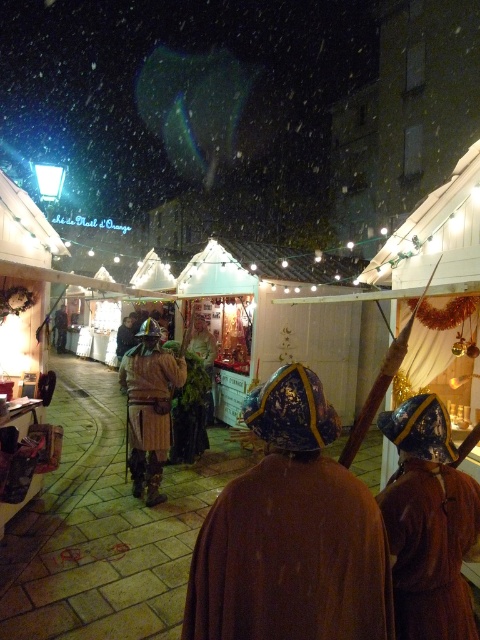
Is point (324, 611) positioned before point (152, 339)?

Yes, point (324, 611) is in front of point (152, 339).

Can you confirm if brown woolen robe at center is bigger than brown leather armor at center?

Incorrect, brown woolen robe at center is not larger than brown leather armor at center.

In the scene shown: Who is more forward, (257, 577) or (165, 403)?

Point (257, 577) is in front.

The height and width of the screenshot is (640, 480). I want to click on brown woolen robe at center, so click(x=290, y=557).

Between point (286, 620) and point (448, 612), which one is positioned in front?

Positioned in front is point (286, 620).

Locate an element on the screen. brown woolen robe at center is located at coordinates pos(290,557).

Is point (230, 483) farther from viewer compared to point (417, 598)?

No, it is not.

Where is `brown woolen robe at center`? brown woolen robe at center is located at coordinates (290, 557).

Which is behind, point (423, 563) or point (145, 432)?

Point (145, 432)

Who is positioned more to the right, brown velvet robe at center or brown leather armor at center?

brown velvet robe at center is more to the right.

Who is more distant from viewer, (424, 492) or (149, 486)?

The point (149, 486) is more distant.

Find the location of a particular element. brown velvet robe at center is located at coordinates (431, 548).